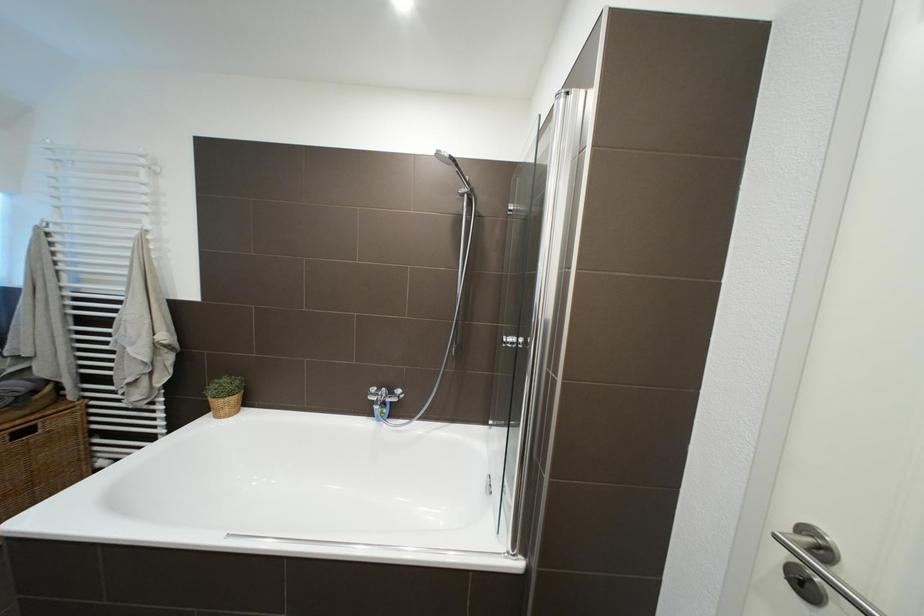
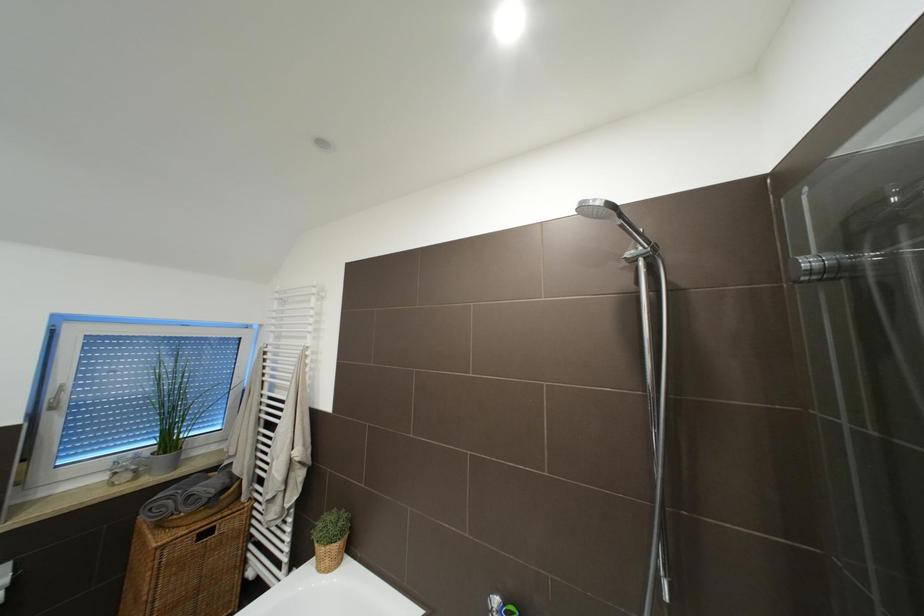
The images are taken continuously from a first-person perspective. In which direction is your viewpoint rotating?

The camera rotated toward left-up.